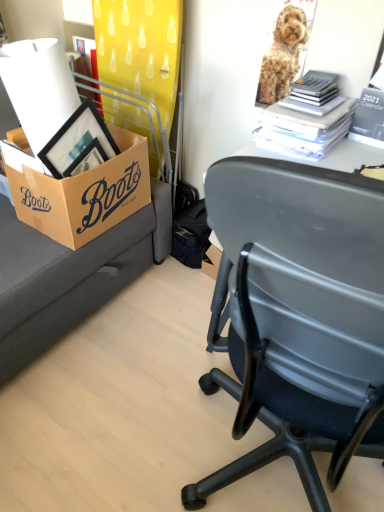
The image size is (384, 512). What are the coordinates of `brown cardboard box at left` in the screenshot? It's located at (80, 191).

The width and height of the screenshot is (384, 512). What do you see at coordinates (307, 118) in the screenshot?
I see `white paper stack at upper right, which is the second book in right-to-left order` at bounding box center [307, 118].

This screenshot has height=512, width=384. What are the coordinates of `golden fur dog at upper right` in the screenshot? It's located at (283, 55).

Choose the correct answer: Is brown cardboard box at left inside golden fur dog at upper right or outside it?

The correct answer is: outside.

How far apart are brown cardboard box at left and golden fur dog at upper right?

27.78 inches.

Would you consider brown cardboard box at left to be distant from golden fur dog at upper right?

No, there isn't a large distance between brown cardboard box at left and golden fur dog at upper right.

Is white paper stack at upper right, which ranks as the 1th book in left-to-right order, to the left of brown cardboard box at left from the viewer's perspective?

No, white paper stack at upper right, which ranks as the 1th book in left-to-right order, is not to the left of brown cardboard box at left.

Measure the distance between white paper stack at upper right, which ranks as the 1th book in left-to-right order, and brown cardboard box at left.

white paper stack at upper right, which ranks as the 1th book in left-to-right order, and brown cardboard box at left are 24.52 inches apart.

From the image's perspective, is white paper stack at upper right, which is the second book in right-to-left order, under brown cardboard box at left?

Incorrect, from the image's perspective, white paper stack at upper right, which is the second book in right-to-left order, is higher than brown cardboard box at left.

Where is `the 2nd book above the brown cardboard box at left (from the image's perspective)`? The width and height of the screenshot is (384, 512). the 2nd book above the brown cardboard box at left (from the image's perspective) is located at coordinates (307, 118).

Considering the sizes of objects brown cardboard box at left and white paper stack at upper right, which is the second book in right-to-left order, in the image provided, who is shorter, brown cardboard box at left or white paper stack at upper right, which is the second book in right-to-left order,?

With less height is white paper stack at upper right, which is the second book in right-to-left order.

From the image's perspective, starting from the brown cardboard box at left, which book is the 2nd one above? Please provide its 2D coordinates.

[(307, 118)]

Would you consider brown cardboard box at left to be distant from white paper stack at upper right, which is the second book in right-to-left order?

brown cardboard box at left is near white paper stack at upper right, which is the second book in right-to-left order, not far away.

From the picture: From a real-world perspective, is brown cardboard box at left on top of white paper stack at upper right, which ranks as the 1th book in left-to-right order?

No, from a real-world perspective, brown cardboard box at left is not on top of white paper stack at upper right, which ranks as the 1th book in left-to-right order.

Which object is more forward, white paper stack at upper right, which is the second book in right-to-left order, or black paper calendar at upper right, arranged as the 2th book when viewed from the left?

black paper calendar at upper right, arranged as the 2th book when viewed from the left, is more forward.

From the image's perspective, would you say white paper stack at upper right, which is the second book in right-to-left order, is positioned over black paper calendar at upper right, the first book viewed from the right?

Yes, from the image's perspective, white paper stack at upper right, which is the second book in right-to-left order, is over black paper calendar at upper right, the first book viewed from the right.

Could you tell me if white paper stack at upper right, which ranks as the 1th book in left-to-right order, is facing black paper calendar at upper right, the first book viewed from the right?

No.

Which is more to the left, white paper stack at upper right, which ranks as the 1th book in left-to-right order, or black paper calendar at upper right, the first book viewed from the right?

Positioned to the left is white paper stack at upper right, which ranks as the 1th book in left-to-right order.

Based on the photo, is golden fur dog at upper right to the left or to the right of black paper calendar at upper right, the first book viewed from the right, in the image?

From the image, it's evident that golden fur dog at upper right is to the left of black paper calendar at upper right, the first book viewed from the right.

Which point is more forward, (294, 66) or (382, 100)?

The point (382, 100) is closer to the camera.

From the image's perspective, is golden fur dog at upper right over black paper calendar at upper right, the first book viewed from the right?

Yes.

In the scene shown: Can we say golden fur dog at upper right lies outside black paper calendar at upper right, arranged as the 2th book when viewed from the left?

golden fur dog at upper right lies outside black paper calendar at upper right, arranged as the 2th book when viewed from the left,'s area.

Between black paper calendar at upper right, the first book viewed from the right, and golden fur dog at upper right, which one appears on the right side from the viewer's perspective?

Positioned to the right is black paper calendar at upper right, the first book viewed from the right.

Is black paper calendar at upper right, arranged as the 2th book when viewed from the left, aimed at golden fur dog at upper right?

No, black paper calendar at upper right, arranged as the 2th book when viewed from the left, does not turn towards golden fur dog at upper right.

From a real-world perspective, is black paper calendar at upper right, the first book viewed from the right, on top of golden fur dog at upper right?

No, from a real-world perspective, black paper calendar at upper right, the first book viewed from the right, is not on top of golden fur dog at upper right.

In the scene shown: Is black paper calendar at upper right, the first book viewed from the right, positioned far away from golden fur dog at upper right?

They are positioned close to each other.

Would you consider black paper calendar at upper right, the first book viewed from the right, to be distant from white paper stack at upper right, which ranks as the 1th book in left-to-right order?

No, there isn't a large distance between black paper calendar at upper right, the first book viewed from the right, and white paper stack at upper right, which ranks as the 1th book in left-to-right order.

Between black paper calendar at upper right, arranged as the 2th book when viewed from the left, and white paper stack at upper right, which ranks as the 1th book in left-to-right order, which one has larger size?

Bigger between the two is white paper stack at upper right, which ranks as the 1th book in left-to-right order.

Considering the relative positions of black paper calendar at upper right, the first book viewed from the right, and white paper stack at upper right, which ranks as the 1th book in left-to-right order, in the image provided, is black paper calendar at upper right, the first book viewed from the right, to the left of white paper stack at upper right, which ranks as the 1th book in left-to-right order, from the viewer's perspective?

No, black paper calendar at upper right, the first book viewed from the right, is not to the left of white paper stack at upper right, which ranks as the 1th book in left-to-right order.

Locate an element on the screen. box in front of the golden fur dog at upper right is located at coordinates (80, 191).

You are a GUI agent. You are given a task and a screenshot of the screen. Output one action in this format:
    pyautogui.click(x=<x>, y=<y>)
    Task: Click on the box to the left of white paper stack at upper right, which is the second book in right-to-left order
    Image resolution: width=384 pixels, height=512 pixels.
    Given the screenshot: What is the action you would take?
    pyautogui.click(x=80, y=191)

Which object lies nearer to the anchor point golden fur dog at upper right, white paper stack at upper right, which is the second book in right-to-left order, or brown cardboard box at left?

white paper stack at upper right, which is the second book in right-to-left order.

Which object lies further to the anchor point black paper calendar at upper right, the first book viewed from the right, golden fur dog at upper right or brown cardboard box at left?

The object further to black paper calendar at upper right, the first book viewed from the right, is brown cardboard box at left.

When comparing their distances from brown cardboard box at left, does black paper calendar at upper right, arranged as the 2th book when viewed from the left, or golden fur dog at upper right seem further?

Based on the image, black paper calendar at upper right, arranged as the 2th book when viewed from the left, appears to be further to brown cardboard box at left.

From the image, which object appears to be farther from black paper calendar at upper right, arranged as the 2th book when viewed from the left, white paper stack at upper right, which ranks as the 1th book in left-to-right order, or brown cardboard box at left?

Based on the image, brown cardboard box at left appears to be further to black paper calendar at upper right, arranged as the 2th book when viewed from the left.

When comparing their distances from golden fur dog at upper right, does black paper calendar at upper right, arranged as the 2th book when viewed from the left, or brown cardboard box at left seem further?

brown cardboard box at left.

Estimate the real-world distances between objects in this image. Which object is further from brown cardboard box at left, white paper stack at upper right, which is the second book in right-to-left order, or black paper calendar at upper right, arranged as the 2th book when viewed from the left?

black paper calendar at upper right, arranged as the 2th book when viewed from the left, is further to brown cardboard box at left.

When comparing their distances from white paper stack at upper right, which is the second book in right-to-left order, does black paper calendar at upper right, the first book viewed from the right, or brown cardboard box at left seem closer?

black paper calendar at upper right, the first book viewed from the right, is positioned closer to the anchor white paper stack at upper right, which is the second book in right-to-left order.

Based on their spatial positions, is golden fur dog at upper right or brown cardboard box at left further from white paper stack at upper right, which is the second book in right-to-left order?

The object further to white paper stack at upper right, which is the second book in right-to-left order, is brown cardboard box at left.

Where is `book between brown cardboard box at left and black paper calendar at upper right, arranged as the 2th book when viewed from the left`? book between brown cardboard box at left and black paper calendar at upper right, arranged as the 2th book when viewed from the left is located at coordinates (307, 118).

What are the coordinates of `dog located between brown cardboard box at left and black paper calendar at upper right, arranged as the 2th book when viewed from the left, in the left-right direction` in the screenshot? It's located at (283, 55).

Locate an element on the screen. The image size is (384, 512). book between golden fur dog at upper right and black paper calendar at upper right, the first book viewed from the right, in the vertical direction is located at coordinates (307, 118).

At what (x,y) coordinates should I click in order to perform the action: click on dog between brown cardboard box at left and white paper stack at upper right, which ranks as the 1th book in left-to-right order, in the horizontal direction. Please return your answer as a coordinate pair (x, y). Looking at the image, I should click on (283, 55).